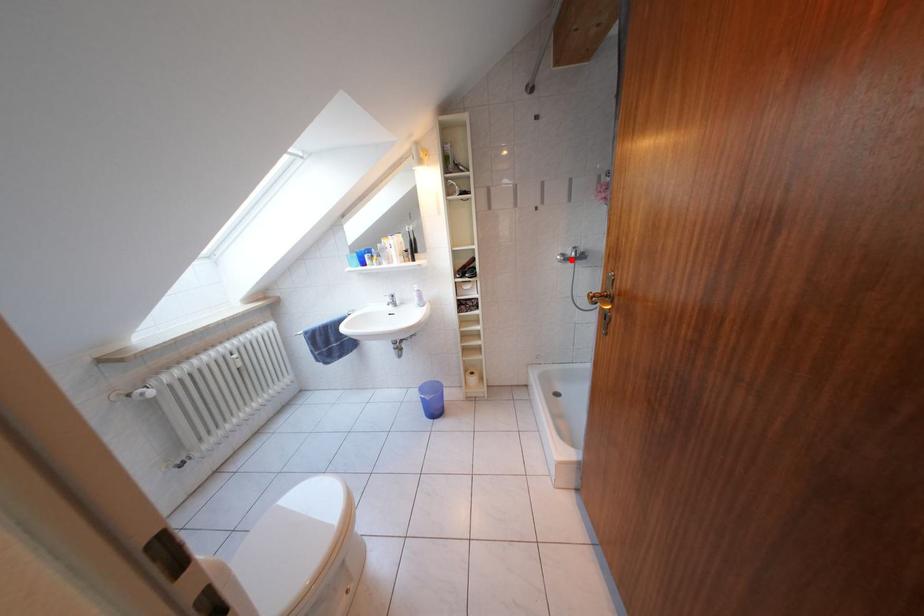
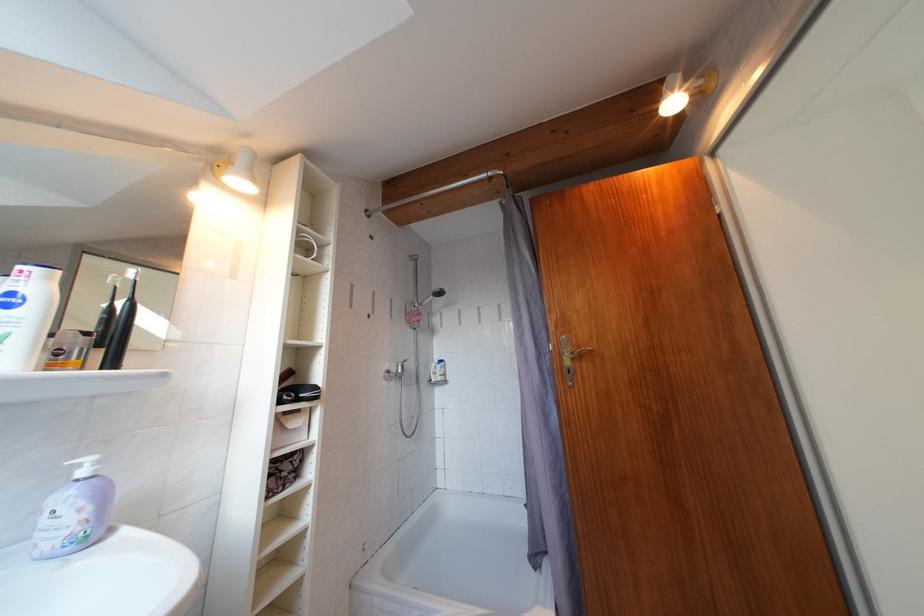
Find the pixel in the second image that matches the highlighted location in the first image.

(396, 377)